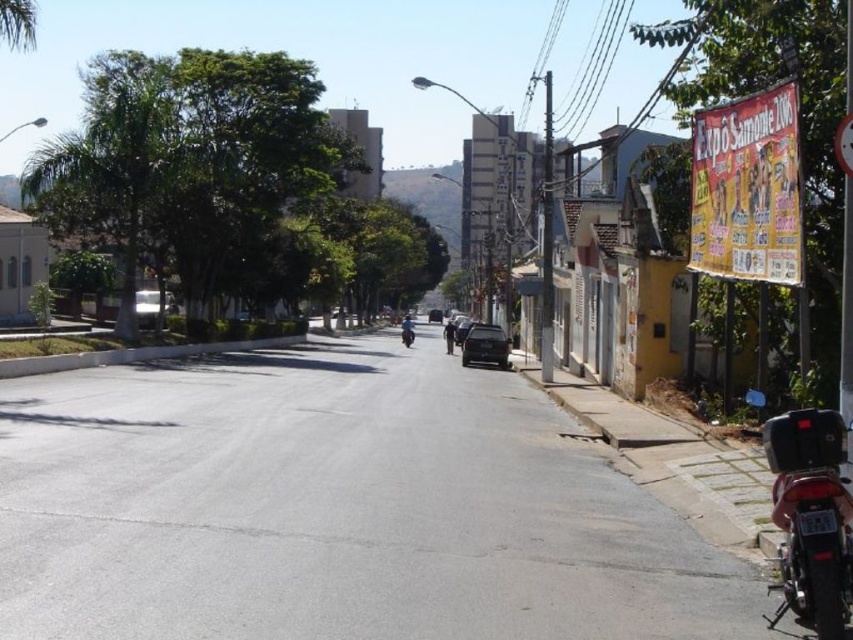
Who is positioned more to the right, blue matte motorcycle at center or matte black car at center?

matte black car at center is more to the right.

Is blue matte motorcycle at center in front of matte black car at center?

Yes, blue matte motorcycle at center is in front of matte black car at center.

What do you see at coordinates (407, 330) in the screenshot? Image resolution: width=853 pixels, height=640 pixels. I see `blue matte motorcycle at center` at bounding box center [407, 330].

The image size is (853, 640). Find the location of `blue matte motorcycle at center`. blue matte motorcycle at center is located at coordinates (407, 330).

Based on the photo, is satin black car at center bigger than matte black car at center?

No.

Does satin black car at center appear under matte black car at center?

Correct, satin black car at center is located below matte black car at center.

Which is in front, point (492, 352) or point (432, 321)?

Point (492, 352)

Locate an element on the screen. The width and height of the screenshot is (853, 640). satin black car at center is located at coordinates (485, 346).

Can you confirm if satin black car at center is wider than shiny black motorcycle at center?

Yes, satin black car at center is wider than shiny black motorcycle at center.

Between point (480, 355) and point (445, 333), which one is positioned behind?

Point (445, 333)

Image resolution: width=853 pixels, height=640 pixels. I want to click on satin black car at center, so click(485, 346).